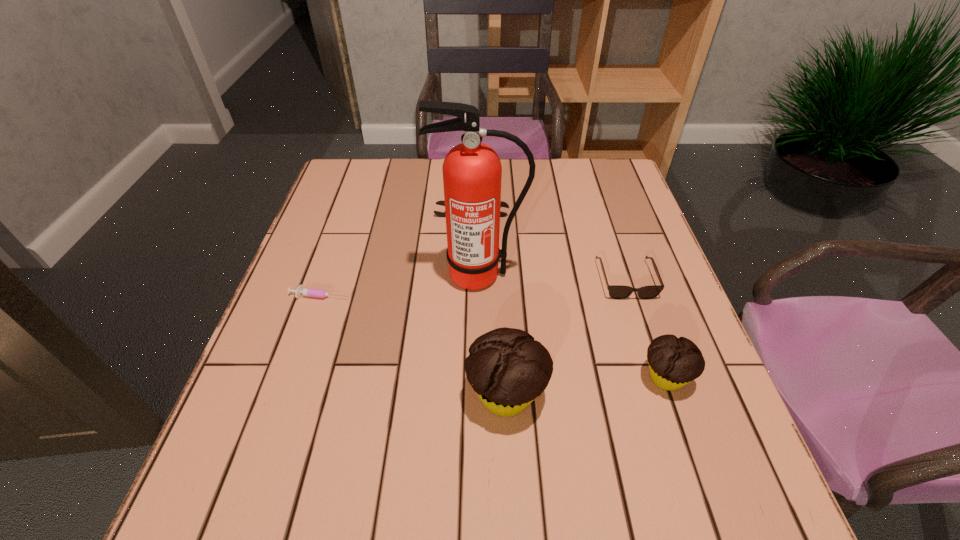
Where is `free space located 0.350m on the left of the fourth shortest object`? The height and width of the screenshot is (540, 960). free space located 0.350m on the left of the fourth shortest object is located at coordinates (457, 377).

Locate an element on the screen. The height and width of the screenshot is (540, 960). free space located on the open ends of the wrench is located at coordinates (471, 231).

This screenshot has width=960, height=540. What are the coordinates of `vacant region located on the handle side of the tallest object` in the screenshot? It's located at (479, 311).

This screenshot has width=960, height=540. I want to click on free space located 0.190m on the front of the leftmost object, so click(x=294, y=374).

Image resolution: width=960 pixels, height=540 pixels. Identify the location of vacant area located at the front lenses of the sunglasses. (658, 377).

You are a GUI agent. You are given a task and a screenshot of the screen. Output one action in this format:
    pyautogui.click(x=<x>, y=<y>)
    Task: Click on the object that is at the near edge
    
    Given the screenshot: What is the action you would take?
    pyautogui.click(x=507, y=368)

You are a GUI agent. You are given a task and a screenshot of the screen. Output one action in this format:
    pyautogui.click(x=<x>, y=<y>)
    Task: Click on the object that is at the left edge
    This screenshot has width=960, height=540.
    Given the screenshot: What is the action you would take?
    pyautogui.click(x=301, y=291)

Locate an element on the screen. This screenshot has height=540, width=960. muffin located at the right edge is located at coordinates (674, 362).

The image size is (960, 540). I want to click on sunglasses positioned at the right edge, so click(x=618, y=292).

This screenshot has height=540, width=960. I want to click on vacant space at the far edge of the desktop, so click(x=413, y=170).